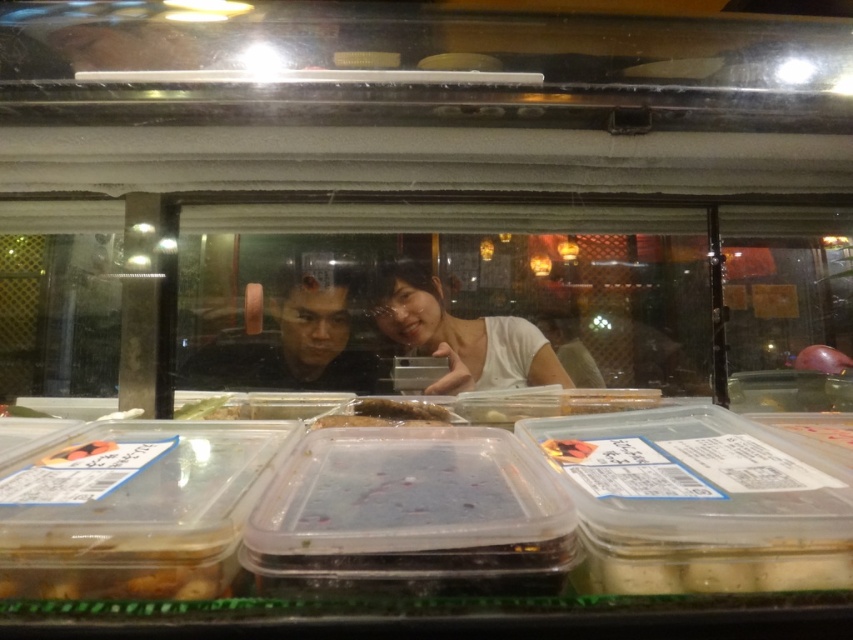
You are a customer at the food stall and want to point out the pink glossy plum at upper right to the attendant wearing the matte white shirt at center. In which direction should you look relative to the shirt to indicate the plum?

The pink glossy plum at upper right is to the right of the matte white shirt at center, so you should look to the right side of the matte white shirt at center to indicate the plum.

You are a customer at this food stall and want to point out the translucent plastic fish at center and the dark purple matte food at lower left to the vendor. Which one is positioned lower in the display?

The translucent plastic fish at center is located below the dark purple matte food at lower left, so the translucent plastic fish at center is positioned lower in the display.